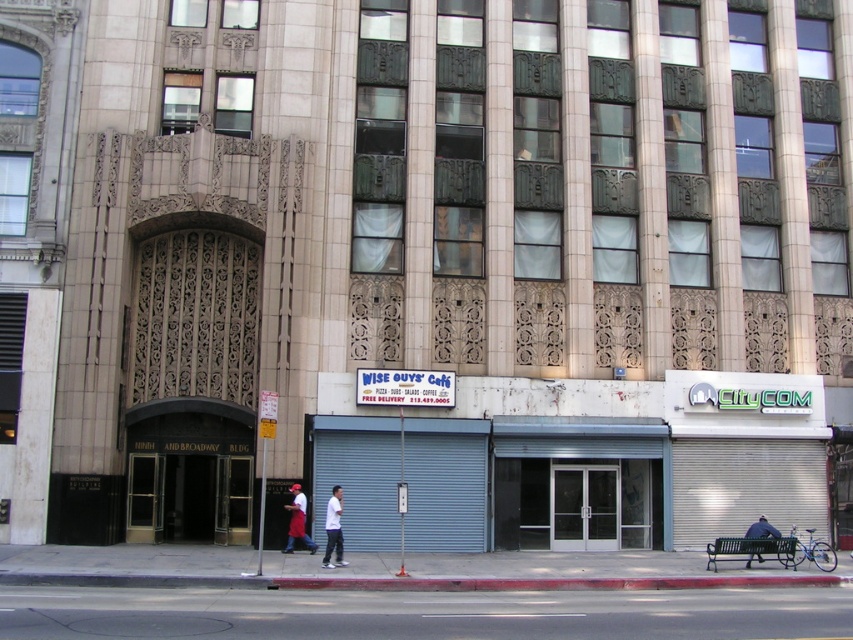
Which is in front, point (90, 632) or point (334, 566)?

Point (90, 632)

Does smooth asphalt road at lower center appear on the right side of white matte shirt at center?

Correct, you'll find smooth asphalt road at lower center to the right of white matte shirt at center.

Which is in front, point (463, 632) or point (335, 509)?

Point (463, 632) is more forward.

I want to click on smooth asphalt road at lower center, so click(422, 612).

Is concrete sidewalk at lower center positioned in front of red apron at center?

Yes.

Is point (408, 584) in front of point (292, 540)?

Yes, it is.

What are the coordinates of `concrete sidewalk at lower center` in the screenshot? It's located at (376, 568).

Which of these two, concrete sidewalk at lower center or white matte shirt at center, stands taller?

With more height is white matte shirt at center.

Is concrete sidewalk at lower center below white matte shirt at center?

Indeed, concrete sidewalk at lower center is positioned under white matte shirt at center.

Image resolution: width=853 pixels, height=640 pixels. I want to click on concrete sidewalk at lower center, so coord(376,568).